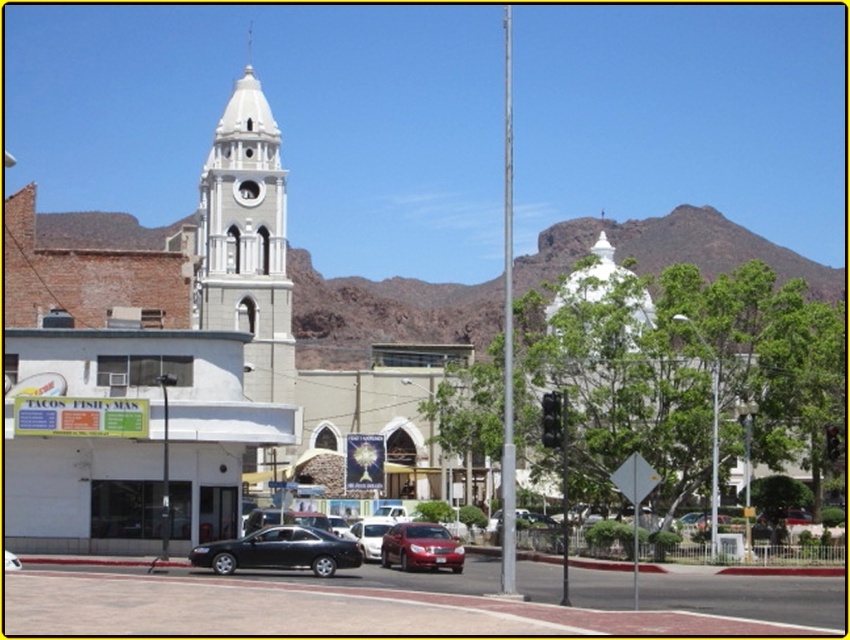
Between white stone clock tower at upper left and shiny red sedan at center, which one has less height?

shiny red sedan at center is shorter.

This screenshot has width=850, height=640. Describe the element at coordinates (246, 241) in the screenshot. I see `white stone clock tower at upper left` at that location.

Where is `white stone clock tower at upper left`? The image size is (850, 640). white stone clock tower at upper left is located at coordinates (246, 241).

You are a GUI agent. You are given a task and a screenshot of the screen. Output one action in this format:
    pyautogui.click(x=<x>, y=<y>)
    Task: Click on the white stone clock tower at upper left
    
    Given the screenshot: What is the action you would take?
    pyautogui.click(x=246, y=241)

Does point (227, 259) come behind point (246, 561)?

Yes, it is.

Who is higher up, white stone clock tower at upper left or matte black sedan at center?

white stone clock tower at upper left is above.

Between point (218, 264) and point (287, 538), which one is positioned in front?

Positioned in front is point (287, 538).

Where is `white stone clock tower at upper left`? white stone clock tower at upper left is located at coordinates (246, 241).

Between matte black sedan at center and shiny red sedan at center, which one is positioned lower?

shiny red sedan at center is below.

Is point (222, 557) positioned before point (442, 544)?

Yes, it is.

This screenshot has height=640, width=850. Find the location of `matte black sedan at center`. matte black sedan at center is located at coordinates (279, 552).